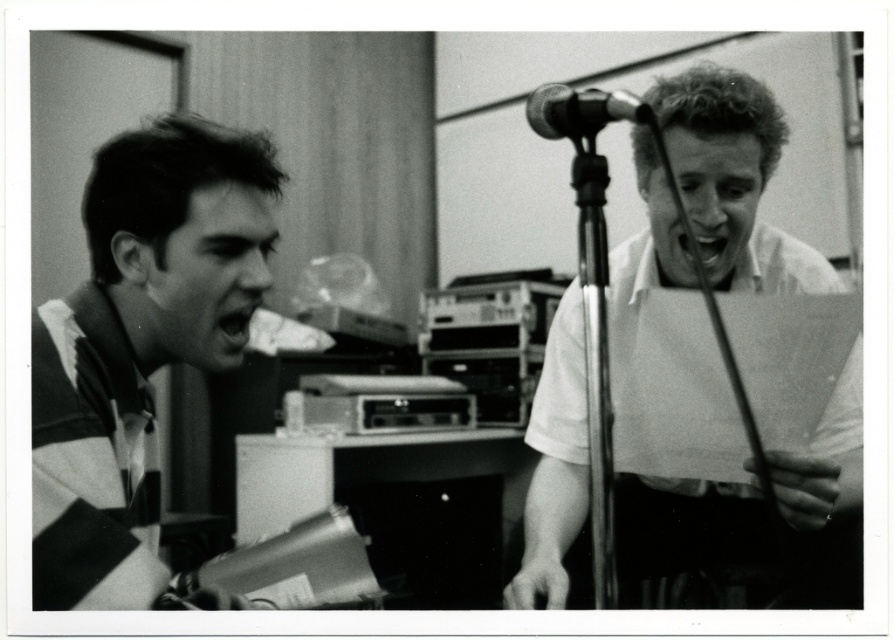
From the picture: Between white paper at right and metallic/metallic microphone at center, which one has more height?

With more height is white paper at right.

Is white paper at right wider than metallic/metallic microphone at center?

Indeed, white paper at right has a greater width compared to metallic/metallic microphone at center.

Identify the location of white paper at right. This screenshot has width=894, height=640. (732, 179).

How much distance is there between striped jersey at left and white paper at right?

The distance of striped jersey at left from white paper at right is 21.43 inches.

Can you confirm if striped jersey at left is wider than white paper at right?

No.

Locate an element on the screen. Image resolution: width=894 pixels, height=640 pixels. striped jersey at left is located at coordinates (140, 348).

Consider the image. Who is taller, striped jersey at left or metallic/metallic microphone at center?

With more height is striped jersey at left.

Does striped jersey at left come in front of metallic/metallic microphone at center?

Yes, striped jersey at left is in front of metallic/metallic microphone at center.

Is point (144, 596) positioned before point (561, 116)?

Yes, point (144, 596) is in front of point (561, 116).

The image size is (894, 640). What are the coordinates of `striped jersey at left` in the screenshot? It's located at (140, 348).